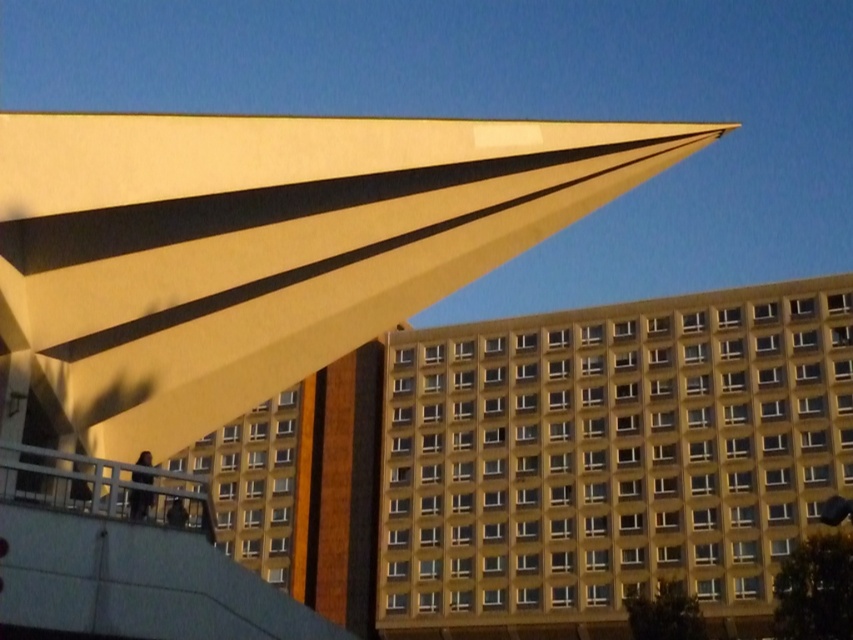
You are standing at a point equidistant from both the brown brick building at center and the yellowish concrete building at center. If you want to walk directly to the closer one, which building should you head towards?

Both buildings are equidistant from your current position, so you can choose either one as they are the same distance away.

You are standing at the point with coordinates point (608, 460). What is the nearest object to you in the scene?

The nearest object to you at point (608, 460) is the brown brick building at center.

You are an architect analyzing the spatial relationship between the brown brick building at center and the yellowish concrete building at center in the image. Which building is placed higher in the scene?

The brown brick building at center is positioned over the yellowish concrete building at center, meaning it is higher in the scene.